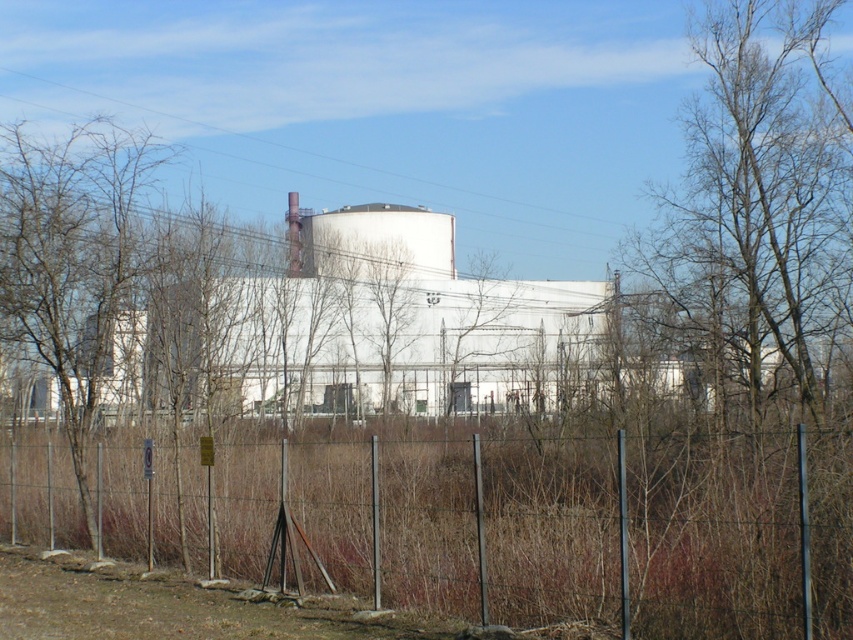
The height and width of the screenshot is (640, 853). Describe the element at coordinates (467, 522) in the screenshot. I see `metal wire fence at center` at that location.

Between metal wire fence at center and bare branches at center, which one appears on the left side from the viewer's perspective?

Positioned to the left is metal wire fence at center.

Which is behind, point (109, 445) or point (732, 97)?

The point (732, 97) is more distant.

What are the coordinates of `metal wire fence at center` in the screenshot? It's located at click(x=467, y=522).

Can you confirm if bare branches at center is positioned below bare branches at left?

Yes.

I want to click on bare branches at center, so click(761, 198).

At what (x,y) coordinates should I click in order to perform the action: click on bare branches at center. Please return your answer as a coordinate pair (x, y). Looking at the image, I should click on (761, 198).

Does metal wire fence at center appear under bare branches at left?

Indeed, metal wire fence at center is positioned under bare branches at left.

Is point (405, 490) farther from viewer compared to point (7, 134)?

No, it is in front of (7, 134).

Measure the distance between metal wire fence at center and camera.

metal wire fence at center is 8.94 meters away from camera.

At what (x,y) coordinates should I click in order to perform the action: click on metal wire fence at center. Please return your answer as a coordinate pair (x, y). This screenshot has height=640, width=853. Looking at the image, I should click on (467, 522).